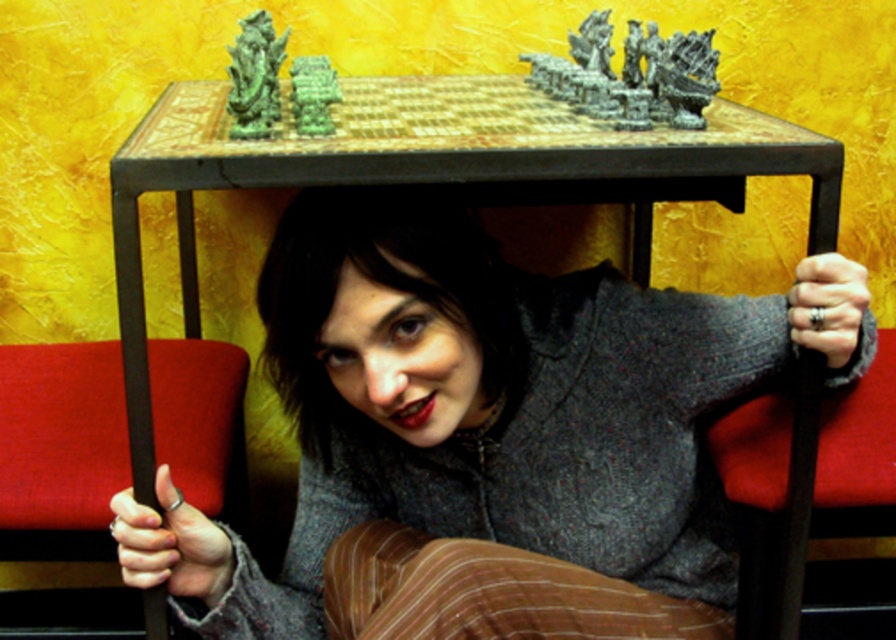
Which is above, rustic wooden table at center or brown leather chair at lower left?

rustic wooden table at center

Can you confirm if rustic wooden table at center is taller than brown leather chair at lower left?

Correct, rustic wooden table at center is much taller as brown leather chair at lower left.

The height and width of the screenshot is (640, 896). What are the coordinates of `rustic wooden table at center` in the screenshot? It's located at (432, 172).

Based on the photo, is brown leather chair at lower left positioned behind dark wood chair at lower right?

That is False.

Is brown leather chair at lower left shorter than dark wood chair at lower right?

Indeed, brown leather chair at lower left has a lesser height compared to dark wood chair at lower right.

Who is more forward, (161, 371) or (873, 433)?

Point (873, 433) is in front.

You are a GUI agent. You are given a task and a screenshot of the screen. Output one action in this format:
    pyautogui.click(x=<x>, y=<y>)
    Task: Click on the brown leather chair at lower left
    This screenshot has height=640, width=896.
    Given the screenshot: What is the action you would take?
    pyautogui.click(x=59, y=449)

Who is more forward, (187, 193) or (819, 403)?

Point (819, 403) is in front.

Who is shorter, rustic wooden table at center or dark wood chair at lower right?

dark wood chair at lower right

Who is more forward, [492,154] or [769,612]?

Positioned in front is point [492,154].

Where is `rustic wooden table at center`? rustic wooden table at center is located at coordinates (432, 172).